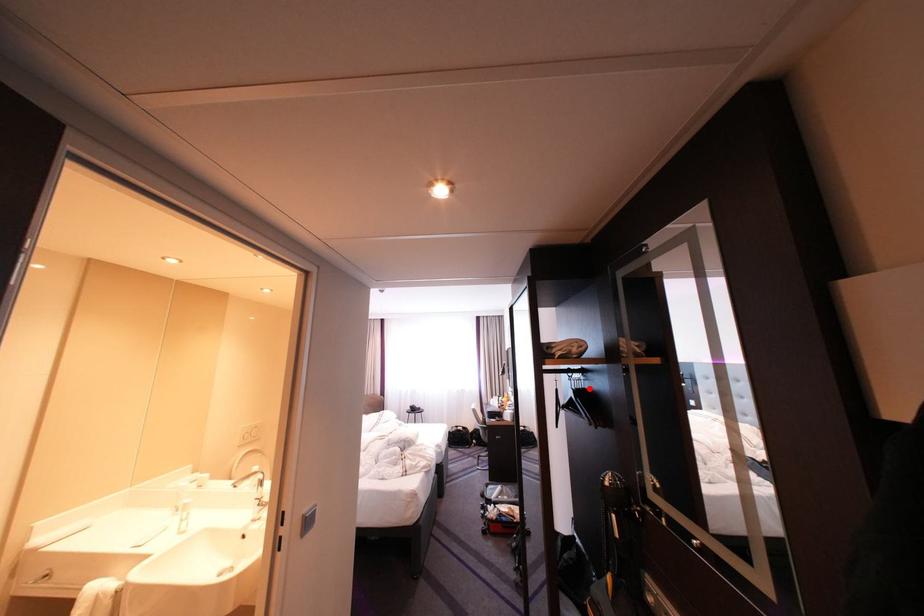
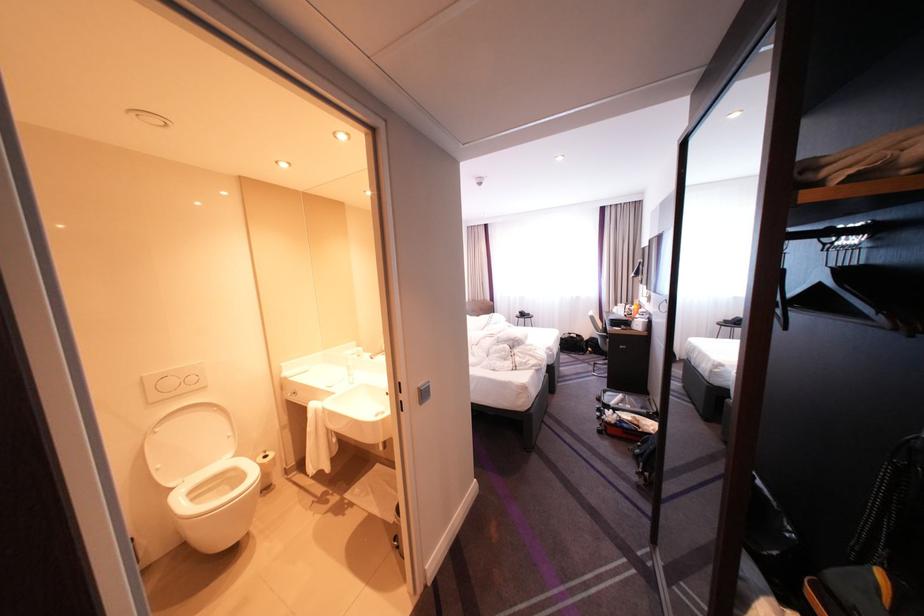
The point at the highlighted location is marked in the first image. Where is the corresponding point in the second image?

(855, 265)